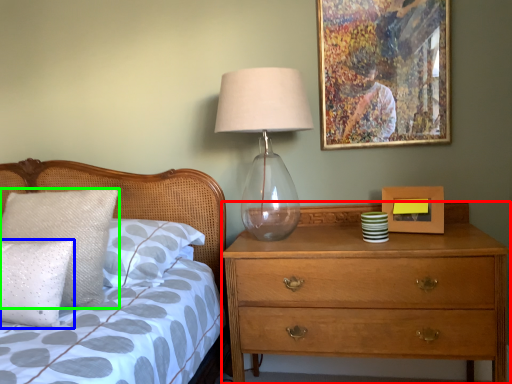
Question: Which object is positioned closest to chest of drawers (highlighted by a red box)? Select from pillow (highlighted by a blue box) and pillow (highlighted by a green box).

Choices:
 (A) pillow
 (B) pillow

Answer: (B)